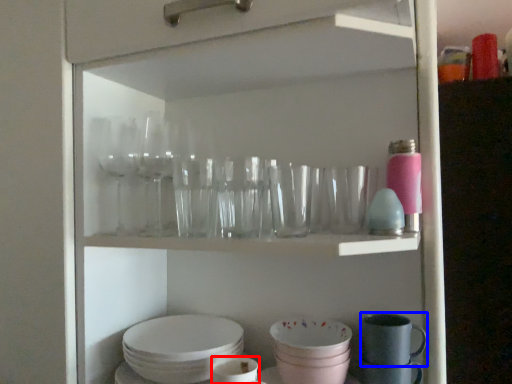
Question: Which of the following is the closest to the observer, tableware (highlighted by a red box) or tableware (highlighted by a blue box)?

Choices:
 (A) tableware
 (B) tableware

Answer: (A)